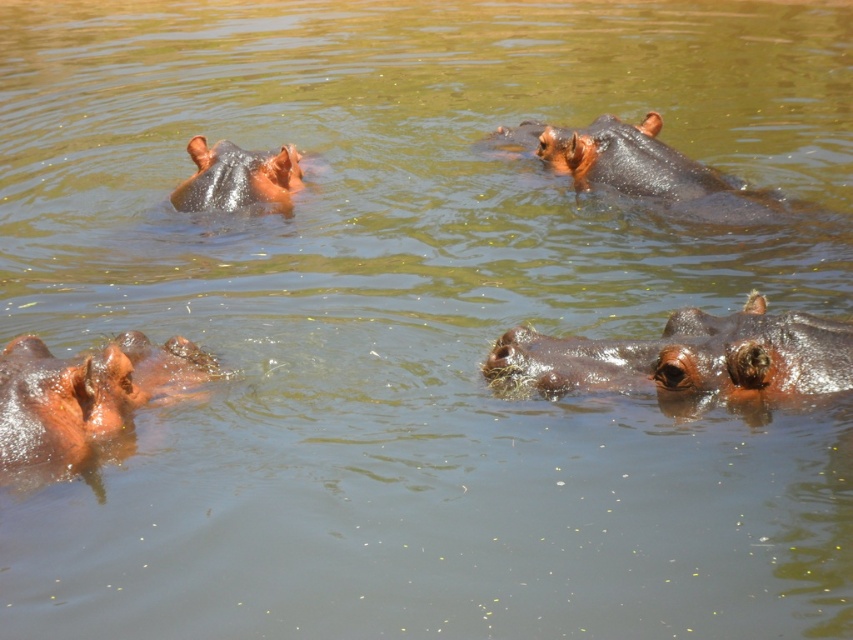
Question: Is shiny dark brown hippo at upper right smaller than brown matte hippo at upper left?

Choices:
 (A) yes
 (B) no

Answer: (B)

Question: Does brown matte hippo at lower right have a lesser width compared to shiny dark brown hippo at upper right?

Choices:
 (A) yes
 (B) no

Answer: (A)

Question: Where is shiny dark brown hippo at upper right located in relation to brown matte hippo at upper left in the image?

Choices:
 (A) left
 (B) right

Answer: (B)

Question: Which of these objects is positioned closest to the smooth brown hippo at left?

Choices:
 (A) shiny dark brown hippo at upper right
 (B) brown matte hippo at upper left

Answer: (B)

Question: Among these points, which one is farthest from the camera?

Choices:
 (A) (281, 164)
 (B) (660, 177)
 (C) (128, 420)

Answer: (A)

Question: Among these objects, which one is nearest to the camera?

Choices:
 (A) brown matte hippo at upper left
 (B) smooth brown hippo at left
 (C) brown matte hippo at lower right

Answer: (B)